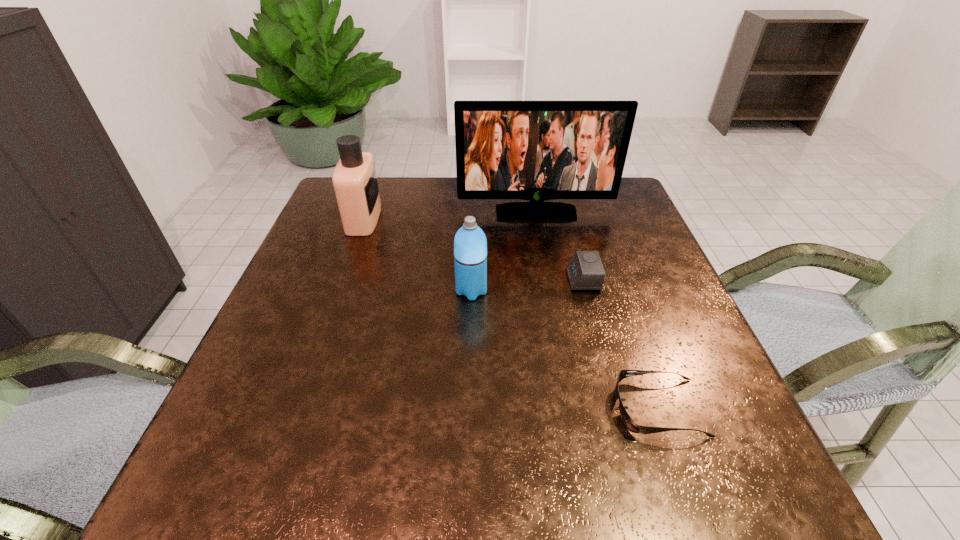
This screenshot has height=540, width=960. I want to click on the tallest object, so click(x=530, y=150).

At what (x,y) coordinates should I click in order to perform the action: click on perfume. Please return your answer as a coordinate pair (x, y). The width and height of the screenshot is (960, 540). Looking at the image, I should click on (355, 183).

Identify the location of the fourth shortest object. Image resolution: width=960 pixels, height=540 pixels. (355, 183).

You are a GUI agent. You are given a task and a screenshot of the screen. Output one action in this format:
    pyautogui.click(x=<x>, y=<y>)
    Task: Click on the thermos bottle
    
    Given the screenshot: What is the action you would take?
    pyautogui.click(x=470, y=245)

I want to click on alarm clock, so click(x=585, y=271).

Where is `the shortest object`? This screenshot has width=960, height=540. the shortest object is located at coordinates (627, 420).

Identify the location of sunglasses. (627, 420).

Locate an element on the screen. vacant space located on the front-facing side of the tallest object is located at coordinates (547, 279).

I want to click on free space located on the front label of the leftmost object, so click(514, 219).

Identify the location of free region located on the right of the thermos bottle. [x=613, y=291].